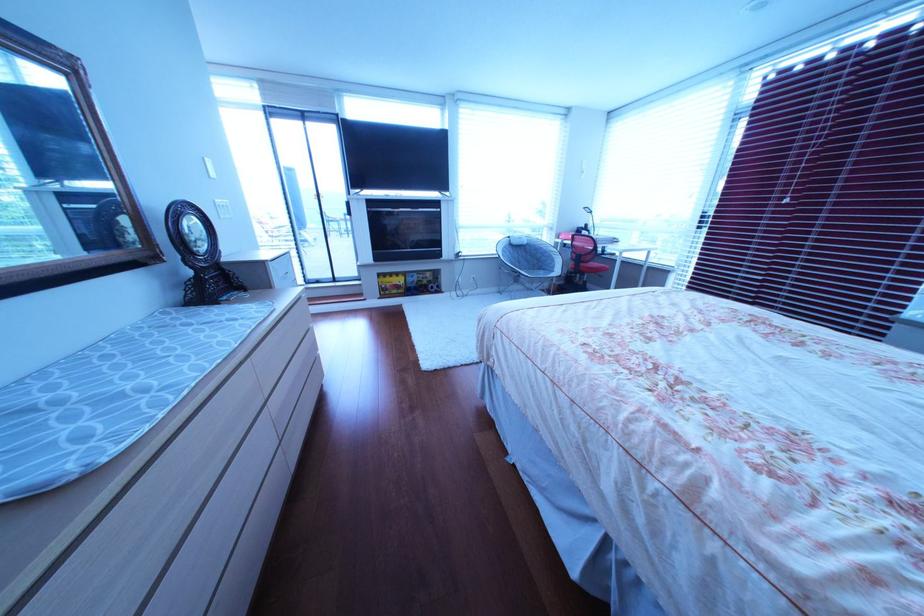
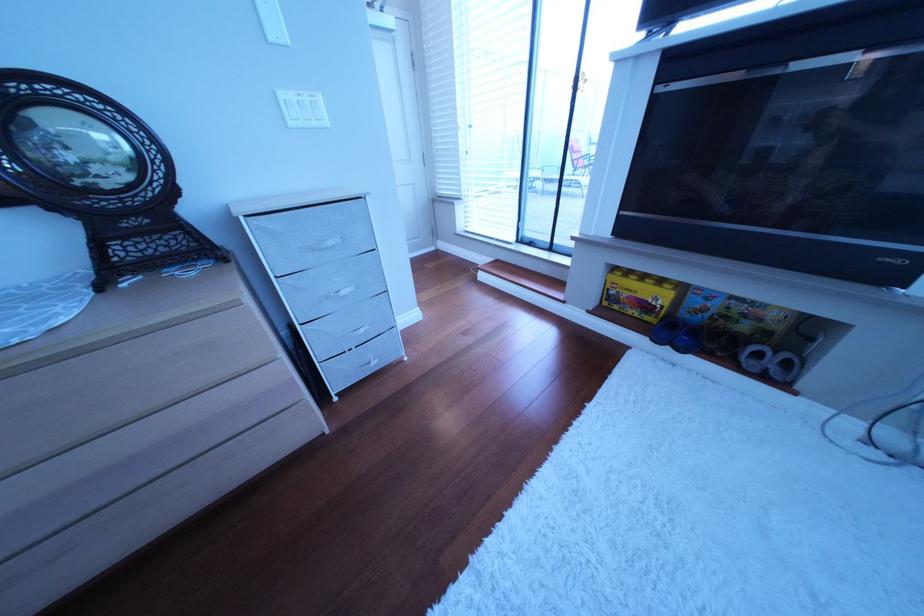
Question: I am providing you with two images of the same scene from different viewpoints. After the viewpoint changes to image2, which objects are now occluded?

Choices:
 (A) light switch rocker
 (B) blue lego box
 (C) yellow lego box
 (D) none of these

Answer: (D)